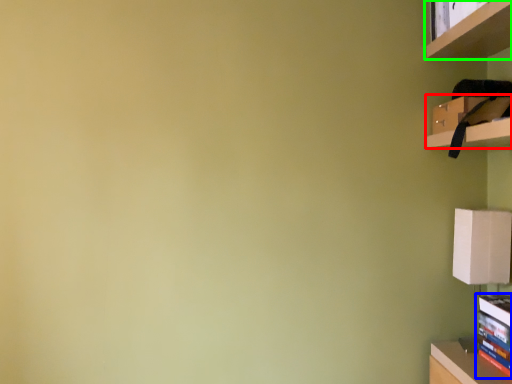
Question: Considering the real-world distances, which object is farthest from cabinet (highlighted by a red box)? book (highlighted by a blue box) or shelf (highlighted by a green box)?

Choices:
 (A) book
 (B) shelf

Answer: (A)